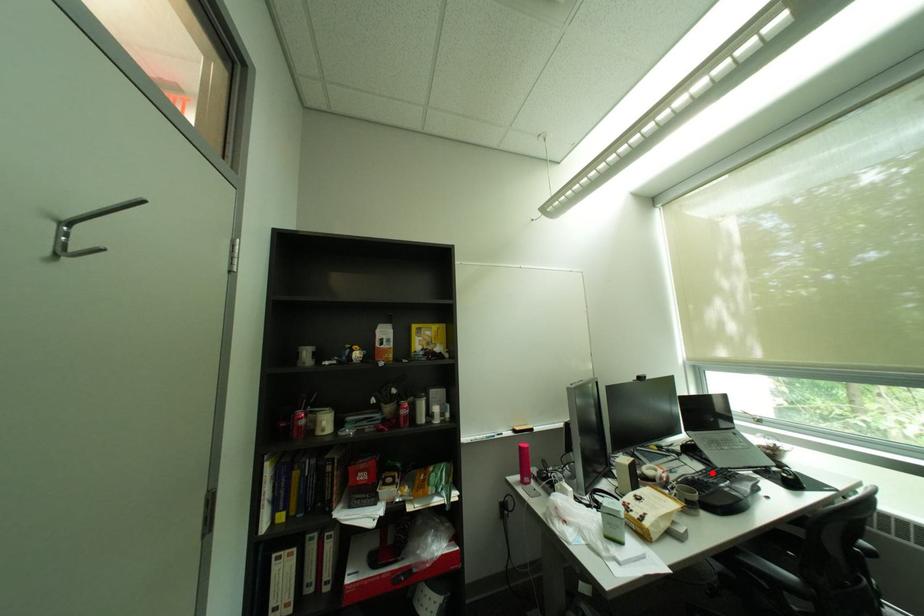
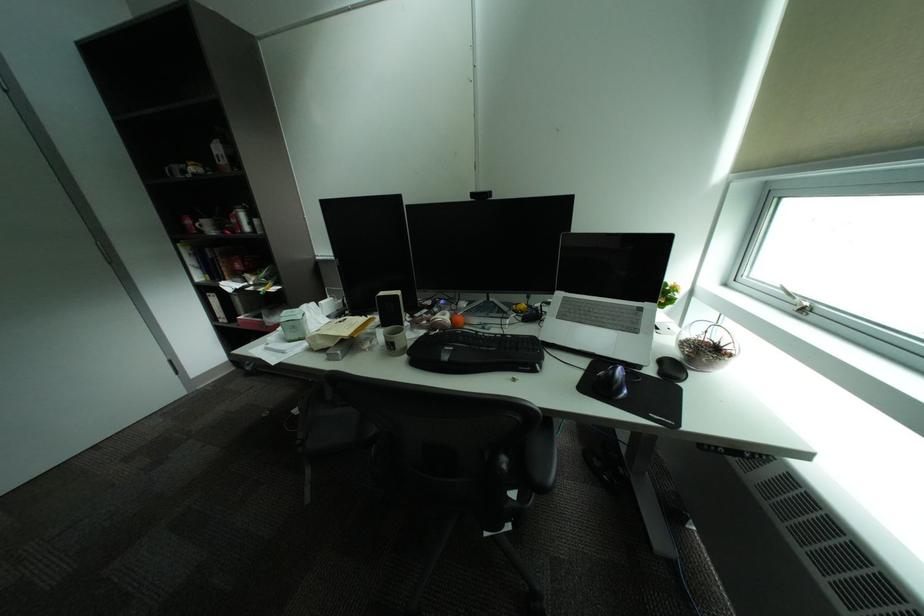
Find the pixel in the second image that matches the highlighted location in the first image.

(516, 336)